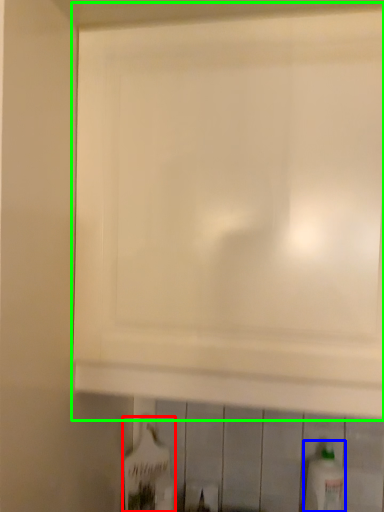
Question: Which object is positioned closest to bottle (highlighted by a red box)? Select from bottle (highlighted by a blue box) and cabinetry (highlighted by a green box).

Choices:
 (A) bottle
 (B) cabinetry

Answer: (A)